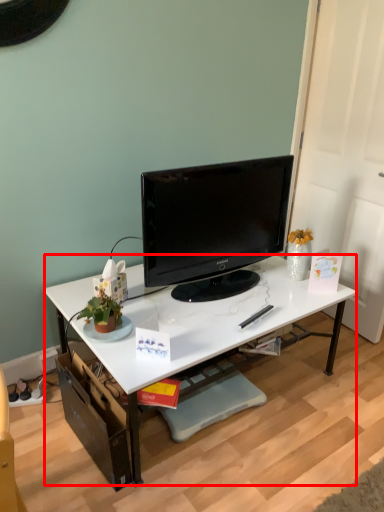
Question: From the image, what is the correct spatial relationship of desk (annotated by the red box) in relation to television?

Choices:
 (A) left
 (B) right

Answer: (A)